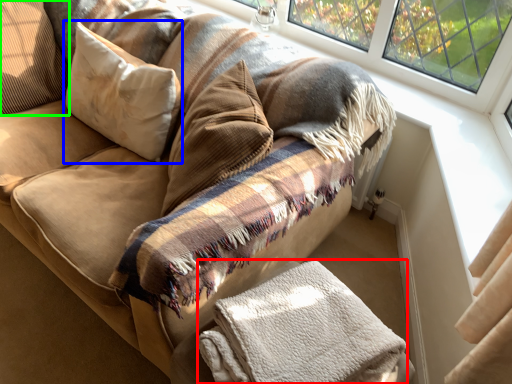
Question: Which object is the closest to the material (highlighted by a red box)? Choose among these: pillow (highlighted by a blue box) or pillow (highlighted by a green box).

Choices:
 (A) pillow
 (B) pillow

Answer: (A)